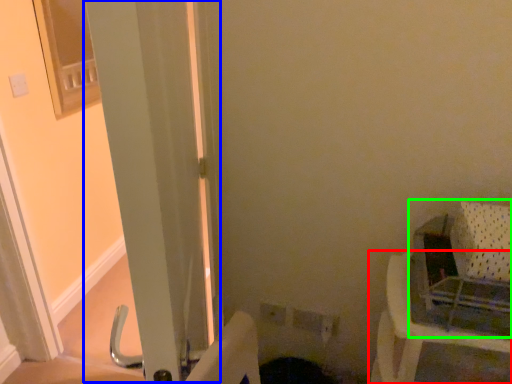
Question: Considering the real-world distances, which object is farthest from furniture (highlighted by a red box)? screen door (highlighted by a blue box) or baby carriage (highlighted by a green box)?

Choices:
 (A) screen door
 (B) baby carriage

Answer: (A)